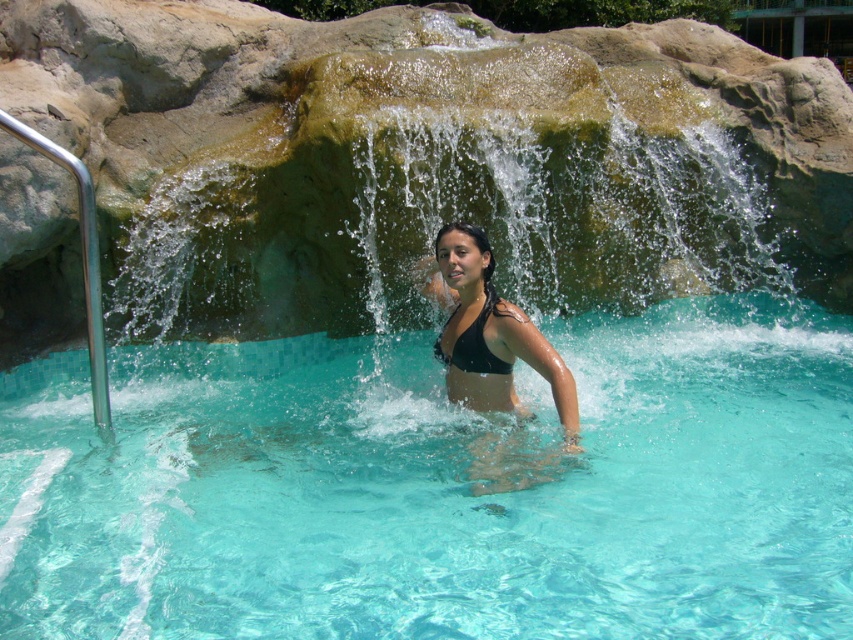
Can you confirm if clear glass swimming pool at center is smaller than black matte bikini at center?

Yes.

Between clear glass swimming pool at center and black matte bikini at center, which one appears on the right side from the viewer's perspective?

Positioned to the right is black matte bikini at center.

Locate an element on the screen. clear glass swimming pool at center is located at coordinates (438, 488).

Can you confirm if clear glass swimming pool at center is taller than black matte bikini top at center?

Incorrect, clear glass swimming pool at center's height is not larger of black matte bikini top at center's.

Can you confirm if clear glass swimming pool at center is positioned above black matte bikini top at center?

Actually, clear glass swimming pool at center is below black matte bikini top at center.

Is point (308, 465) less distant than point (469, 355)?

No, (308, 465) is behind (469, 355).

I want to click on clear glass swimming pool at center, so click(438, 488).

Who is more distant from viewer, [456,292] or [479,342]?

The point [456,292] is more distant.

Does black matte bikini at center appear over black matte bikini top at center?

No.

The width and height of the screenshot is (853, 640). Find the location of `black matte bikini at center`. black matte bikini at center is located at coordinates (494, 356).